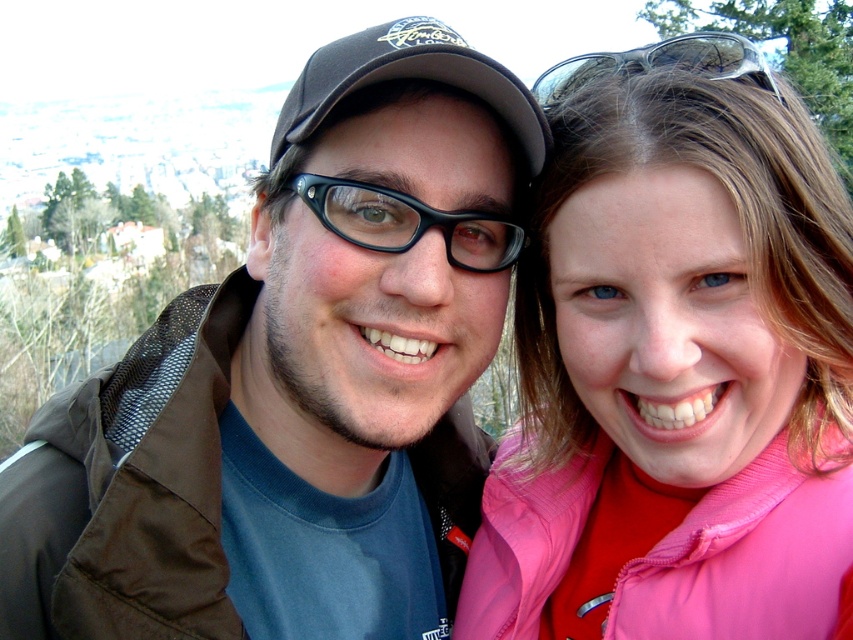
Consider the image. Does matte black jacket at center appear under pink fabric jacket at upper right?

Indeed, matte black jacket at center is positioned under pink fabric jacket at upper right.

In the scene shown: Is matte black jacket at center wider than pink fabric jacket at upper right?

Result: Yes, matte black jacket at center is wider than pink fabric jacket at upper right.

Is point (227, 600) positioned behind point (637, 358)?

No.

Where is `matte black jacket at center`? matte black jacket at center is located at coordinates (299, 380).

Which is below, matte black jacket at center or clear plastic goggles at upper right?

matte black jacket at center is lower down.

Does matte black jacket at center appear on the left side of clear plastic goggles at upper right?

Yes, matte black jacket at center is to the left of clear plastic goggles at upper right.

Does point (454, 506) lie in front of point (573, 56)?

Yes, it is in front of point (573, 56).

Where is `matte black jacket at center`? matte black jacket at center is located at coordinates (299, 380).

Which is more to the left, pink fabric jacket at upper right or clear plastic goggles at upper right?

pink fabric jacket at upper right

How distant is pink fabric jacket at upper right from clear plastic goggles at upper right?

pink fabric jacket at upper right is 24.50 meters from clear plastic goggles at upper right.

Is point (741, 608) closer to camera compared to point (546, 88)?

Yes, it is.

Locate an element on the screen. This screenshot has height=640, width=853. pink fabric jacket at upper right is located at coordinates (676, 376).